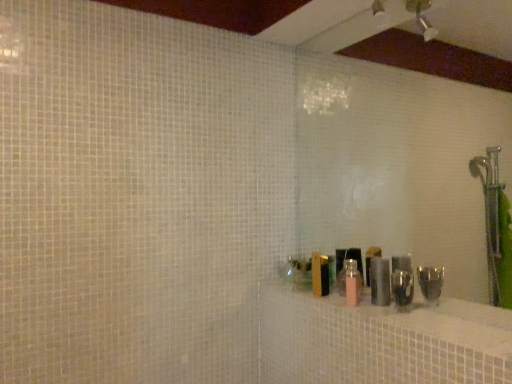
Question: Considering the relative sizes of pink matte bottle at center and metallic silver canister at right, which is the first toiletry from right to left, in the image provided, is pink matte bottle at center thinner than metallic silver canister at right, which is the first toiletry from right to left,?

Choices:
 (A) no
 (B) yes

Answer: (A)

Question: Is pink matte bottle at center turned away from metallic silver canister at right, the 2th toiletry when ordered from left to right?

Choices:
 (A) no
 (B) yes

Answer: (A)

Question: From the image's perspective, would you say pink matte bottle at center is shown under metallic silver canister at right, the 2th toiletry when ordered from left to right?

Choices:
 (A) yes
 (B) no

Answer: (A)

Question: From a real-world perspective, is pink matte bottle at center beneath metallic silver canister at right, the 2th toiletry when ordered from left to right?

Choices:
 (A) no
 (B) yes

Answer: (B)

Question: Is pink matte bottle at center to the left of metallic silver canister at right, which is the first toiletry from right to left, from the viewer's perspective?

Choices:
 (A) no
 (B) yes

Answer: (B)

Question: Considering the positions of point (507, 327) and point (371, 269), is point (507, 327) closer or farther from the camera than point (371, 269)?

Choices:
 (A) farther
 (B) closer

Answer: (B)

Question: From the image's perspective, relative to metallic silver canister at right, the 2th toiletry when ordered from left to right, is pink matte bottle at center above or below?

Choices:
 (A) below
 (B) above

Answer: (A)

Question: Would you say pink matte bottle at center is to the left or to the right of metallic silver canister at right, which is the first toiletry from right to left, in the picture?

Choices:
 (A) right
 (B) left

Answer: (B)

Question: Looking at the image, does pink matte bottle at center seem bigger or smaller compared to metallic silver canister at right, the 2th toiletry when ordered from left to right?

Choices:
 (A) big
 (B) small

Answer: (A)

Question: Which is correct: metallic silver canister at right, which is the first toiletry from right to left, is inside pink matte bottle at center, which is the 1th toiletry from left to right, or outside of it?

Choices:
 (A) inside
 (B) outside

Answer: (B)

Question: From a real-world perspective, is metallic silver canister at right, the 2th toiletry when ordered from left to right, positioned above or below pink matte bottle at center, the 2th toiletry from the right?

Choices:
 (A) above
 (B) below

Answer: (A)

Question: Does point (380, 259) appear closer or farther from the camera than point (343, 256)?

Choices:
 (A) farther
 (B) closer

Answer: (B)

Question: Is metallic silver canister at right, which is the first toiletry from right to left, bigger or smaller than pink matte bottle at center, the 2th toiletry from the right?

Choices:
 (A) small
 (B) big

Answer: (A)

Question: Is pink matte bottle at center wider or thinner than pink matte bottle at center, the 2th toiletry from the right?

Choices:
 (A) wide
 (B) thin

Answer: (A)

Question: Considering the positions of point (411, 360) and point (357, 256), is point (411, 360) closer or farther from the camera than point (357, 256)?

Choices:
 (A) farther
 (B) closer

Answer: (B)